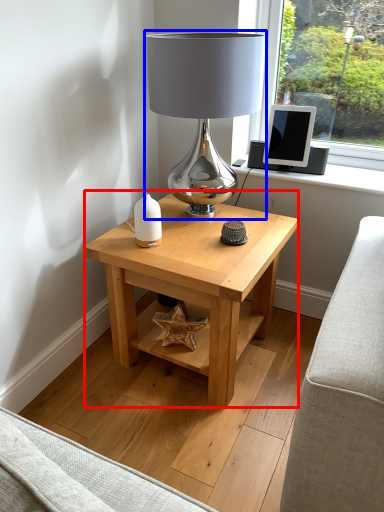
Question: Which object appears farthest to the camera in this image, table (highlighted by a red box) or lamp (highlighted by a blue box)?

Choices:
 (A) table
 (B) lamp

Answer: (A)